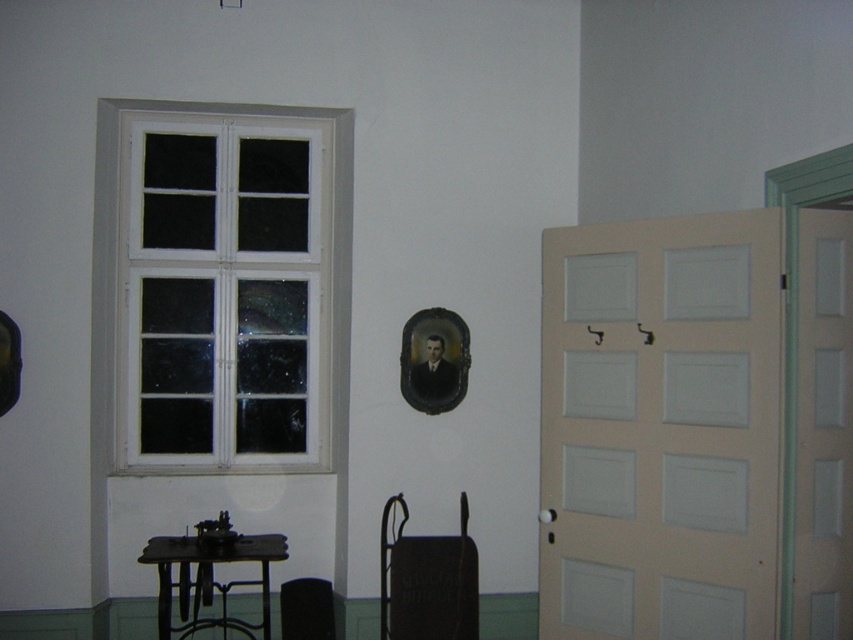
You are planning to place a rectangular box that is 2 meters wide between the matte black chair at lower center and the metallic black table at lower left. Based on the scene description, will the box fit between them?

The matte black chair at lower center has a lesser width compared to the metallic black table at lower left. Since the box is 2 meters wide, it is uncertain if there is enough space between them as the exact distance isnanot provided. The answer cannot be determined with the given information.

From the picture: You are trying to decide whether to place a floor lamp next to the metallic black table at lower left or near the white matte door at right. Based on their sizes, which object would allow the lamp to be placed closer to the wall without blocking the doorway?

The white matte door at right is much taller than the metallic black table at lower left, so placing the floor lamp near the door might require more space vertically, potentially blocking the doorway. The metallic black table at lower left is shorter, so placing the lamp there would allow it to be closer to the wall without obstruction.